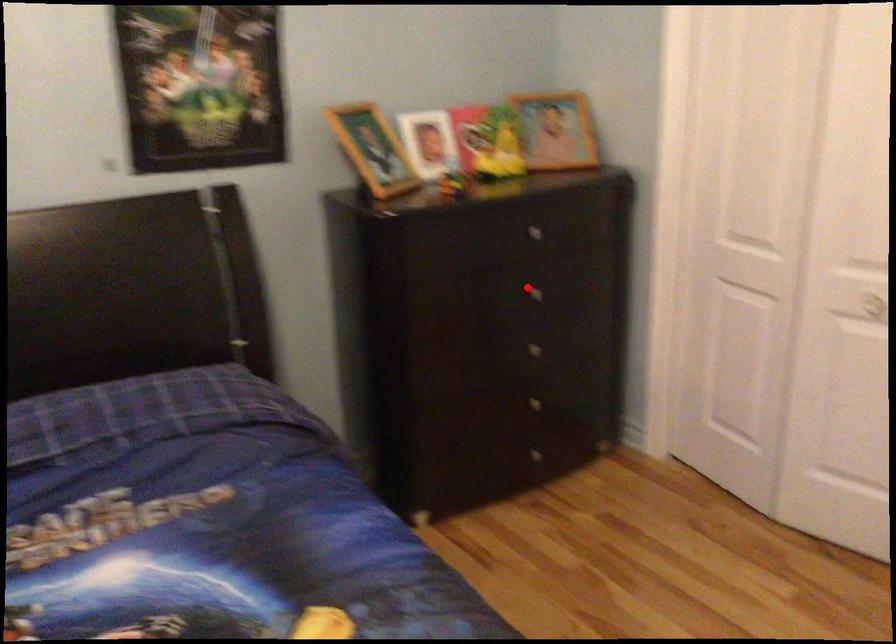
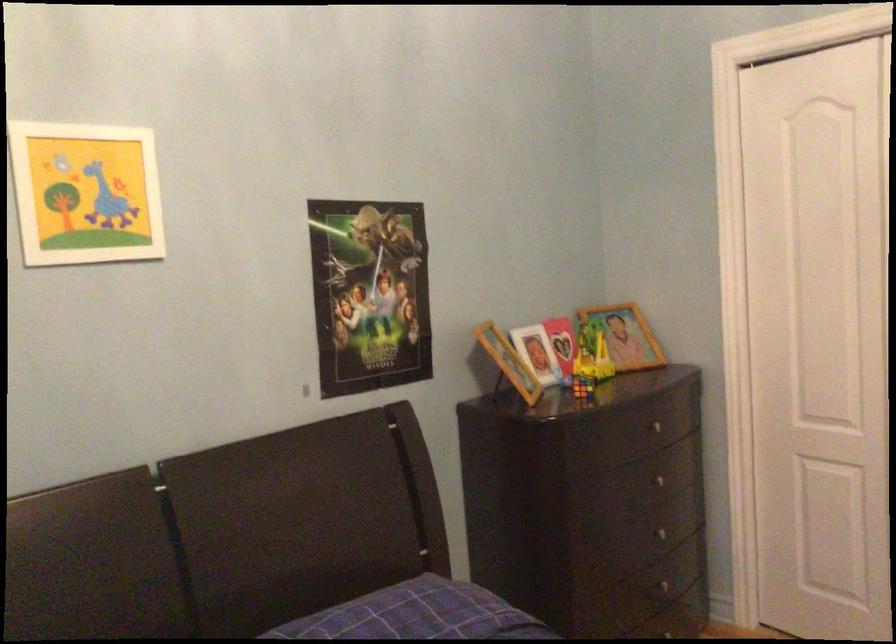
Question: I am providing you with two images of the same scene from different viewpoints. Given a red point in image1, look at the same physical point in image2. Is it:

Choices:
 (A) Closer to the viewpoint
 (B) Farther from the viewpoint

Answer: (B)